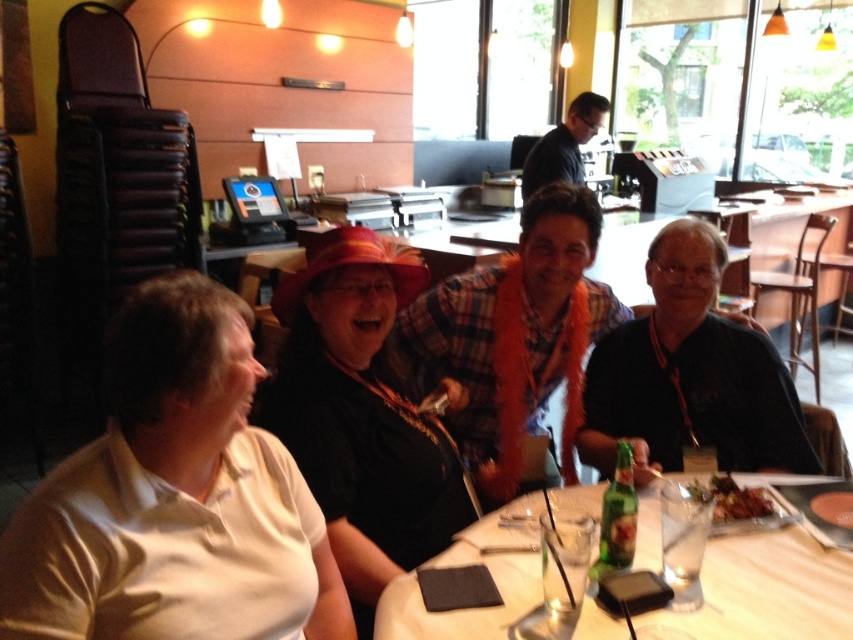
Question: Is black fabric shirt at right smaller than shiny brown plate at table center?

Choices:
 (A) yes
 (B) no

Answer: (B)

Question: From the image, what is the correct spatial relationship of black fabric shirt at right in relation to shiny brown plate at table center?

Choices:
 (A) above
 (B) below

Answer: (A)

Question: Among these objects, which one is nearest to the camera?

Choices:
 (A) shiny brown plate at table center
 (B) black fabric shirt at right
 (C) white matte shirt at left
 (D) matte black shirt at center

Answer: (C)

Question: Does black fabric shirt at right have a smaller size compared to shiny brown plate at table center?

Choices:
 (A) yes
 (B) no

Answer: (B)

Question: Considering the real-world distances, which object is closest to the white matte shirt at left?

Choices:
 (A) matte black shirt at center
 (B) shiny brown plate at table center
 (C) black fabric shirt at right
 (D) clear glass table at center

Answer: (A)

Question: Which of the following is the closest to the observer?

Choices:
 (A) (717, 509)
 (B) (708, 268)
 (C) (705, 593)

Answer: (C)